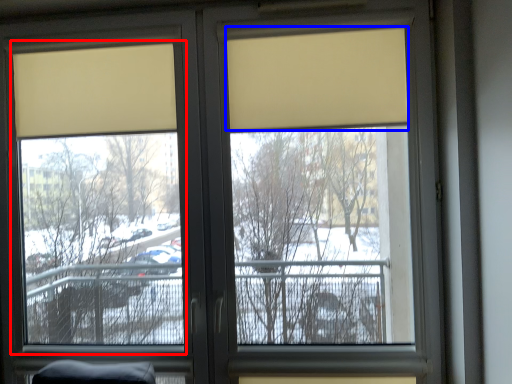
Question: Which object is further to the camera taking this photo, window screen (highlighted by a red box) or curtain (highlighted by a blue box)?

Choices:
 (A) window screen
 (B) curtain

Answer: (A)